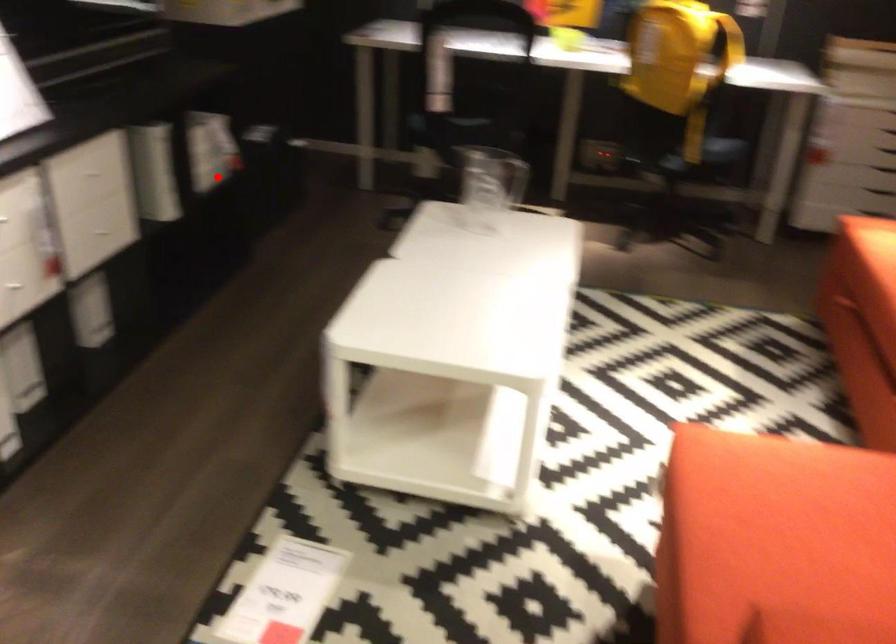
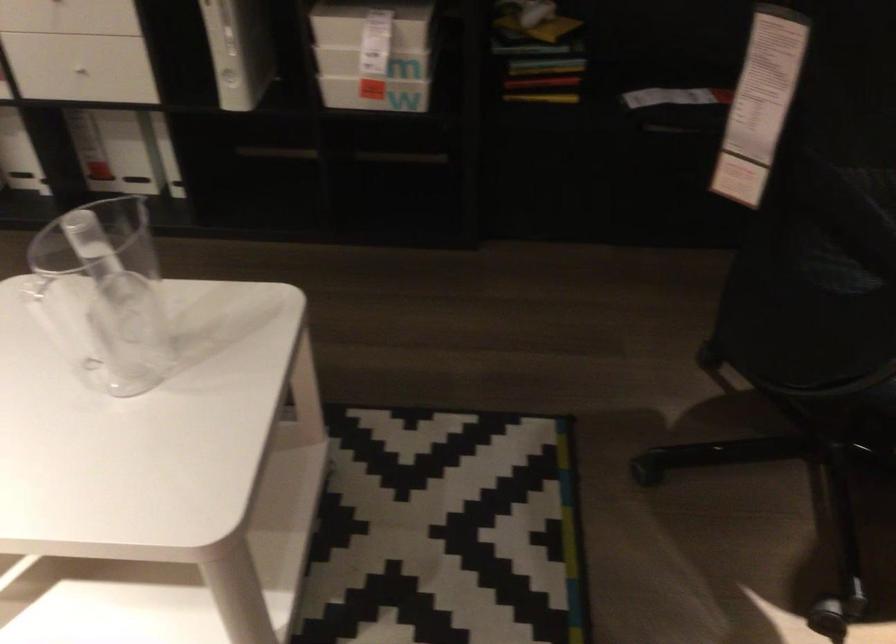
The point at the highlighted location is marked in the first image. Where is the corresponding point in the second image?

(375, 93)